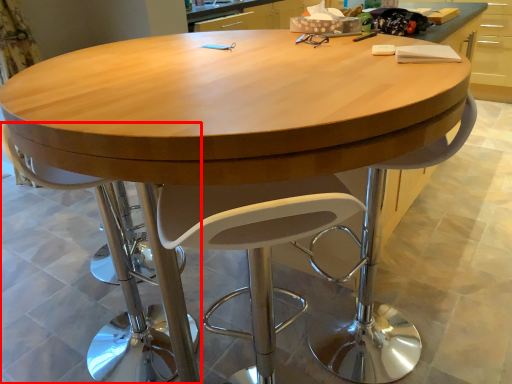
Question: From the image's perspective, considering the relative positions of chair (annotated by the red box) and swivel chair in the image provided, where is chair (annotated by the red box) located with respect to the staircase?

Choices:
 (A) below
 (B) above

Answer: (B)